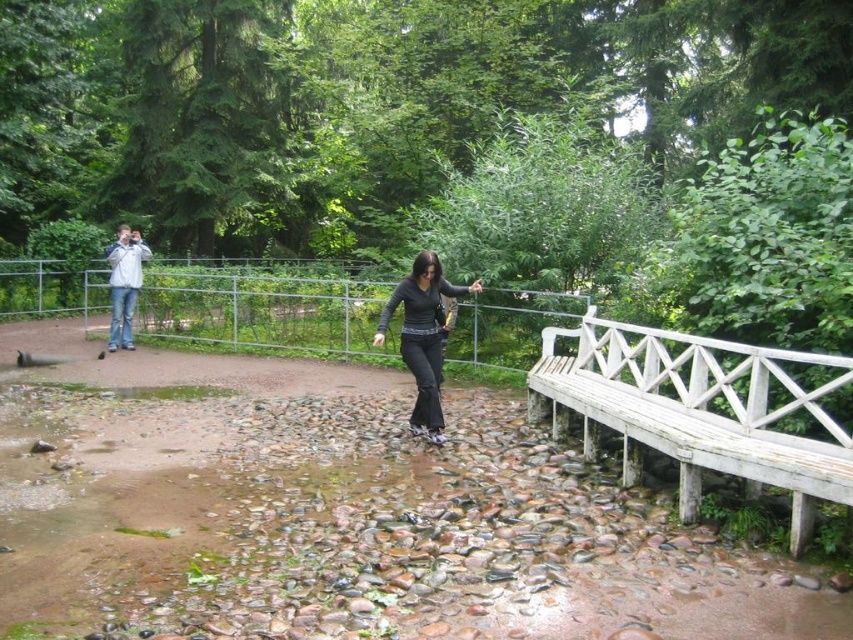
You are standing on the wooden bridge with white railings and want to walk to the black matte pants at center. Which direction should you move relative to the jeans at left?

You should move to the right relative to the jeans at left because the black matte pants at center is located to the right of the jeans at left.

You are standing at the wooden bridge and want to walk to the paved pathway. You see two points marked in the scene. Which point, point (659, 339) or point (427, 413), is closer to you as you stand on the bridge?

Point (659, 339) is closer to the viewer than point (427, 413).

Consider the image. You are standing on the wooden bridge and want to sit down. You see a white wooden bench at right and a black matte pants at center. Which object is closer to you?

The white wooden bench at right is closer to the viewer than the black matte pants at center.